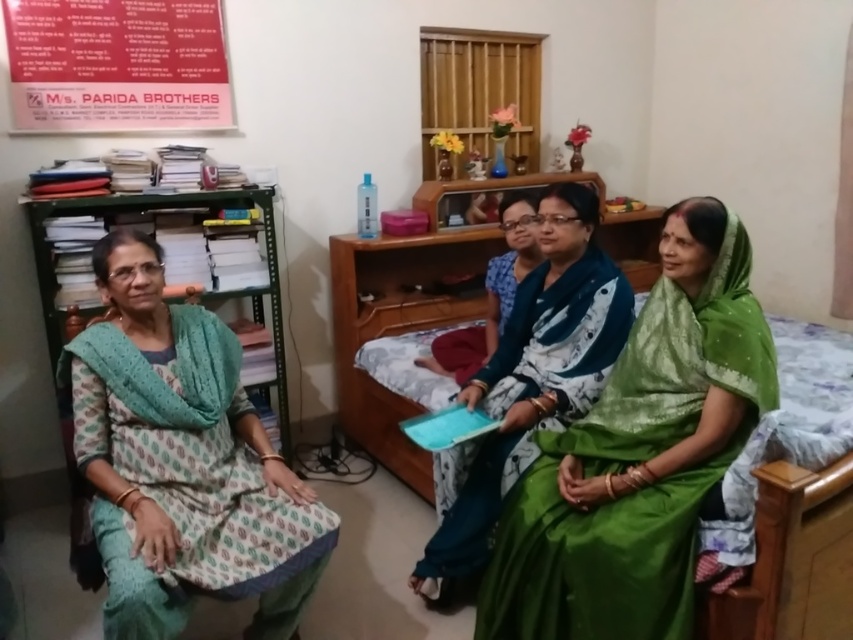
Question: Can you confirm if green silk saree at center is smaller than printed cotton dress at left?

Choices:
 (A) yes
 (B) no

Answer: (A)

Question: Which point appears farthest from the camera in this image?

Choices:
 (A) [218, 580]
 (B) [584, 412]
 (C) [646, 406]

Answer: (B)

Question: Observing the image, what is the correct spatial positioning of green silk saree at center in reference to silky green saree at center?

Choices:
 (A) right
 (B) left

Answer: (A)

Question: Which is farther from the green silk saree at center?

Choices:
 (A) silky green saree at center
 (B) printed cotton dress at left
 (C) red paper poster at upper left

Answer: (C)

Question: Which object appears closest to the camera in this image?

Choices:
 (A) printed cotton dress at left
 (B) silky green saree at center
 (C) green silk saree at center

Answer: (A)

Question: Does silky green saree at center come in front of red paper poster at upper left?

Choices:
 (A) yes
 (B) no

Answer: (A)